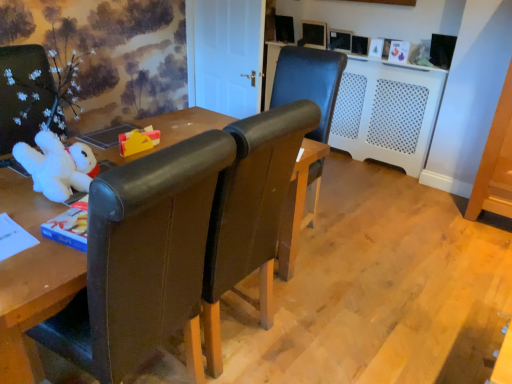
Where is `vacant space situated on the left part of matte yellow toy at center, placed as the 2th toy when sorted from front to back`? vacant space situated on the left part of matte yellow toy at center, placed as the 2th toy when sorted from front to back is located at coordinates (106, 148).